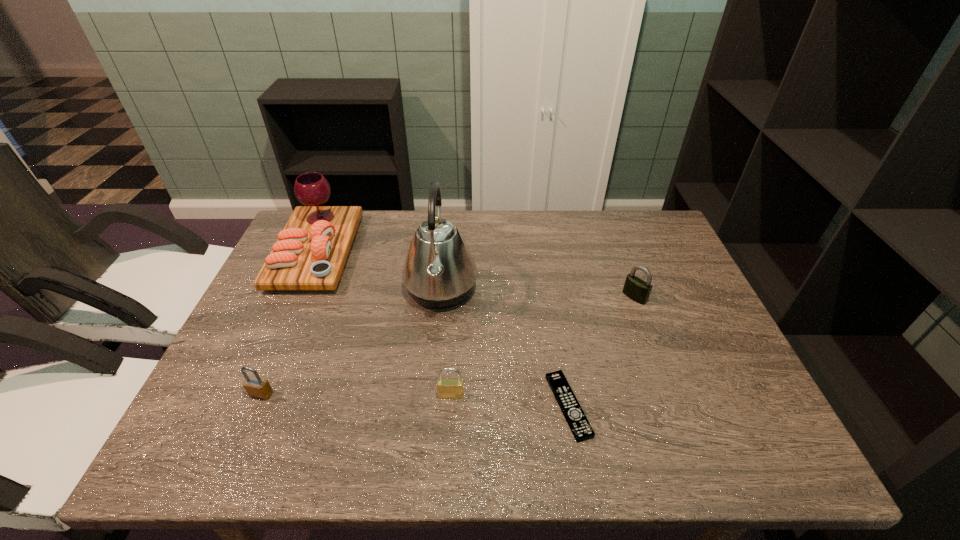
Where is `free space that satisfies the following two spatial constraints: 1. on the front side of the rightmost object; 2. on the right side of the platter`? Image resolution: width=960 pixels, height=540 pixels. free space that satisfies the following two spatial constraints: 1. on the front side of the rightmost object; 2. on the right side of the platter is located at coordinates (297, 297).

Locate an element on the screen. free space that satisfies the following two spatial constraints: 1. from the spout of the tallest object; 2. on the right side of the farthest padlock is located at coordinates (440, 297).

This screenshot has height=540, width=960. In order to click on vacant area in the image that satisfies the following two spatial constraints: 1. from the spout of the tallest object; 2. on the back side of the shortest object in this screenshot , I will do `click(430, 406)`.

Find the location of a particular element. Image resolution: width=960 pixels, height=540 pixels. free spot that satisfies the following two spatial constraints: 1. from the spout of the kettle; 2. on the front side of the leftmost padlock is located at coordinates (431, 394).